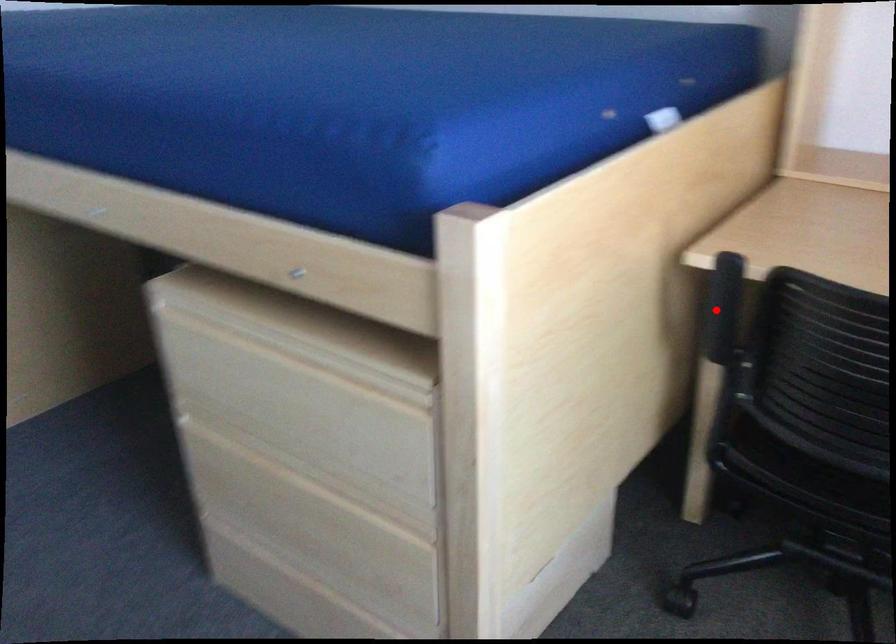
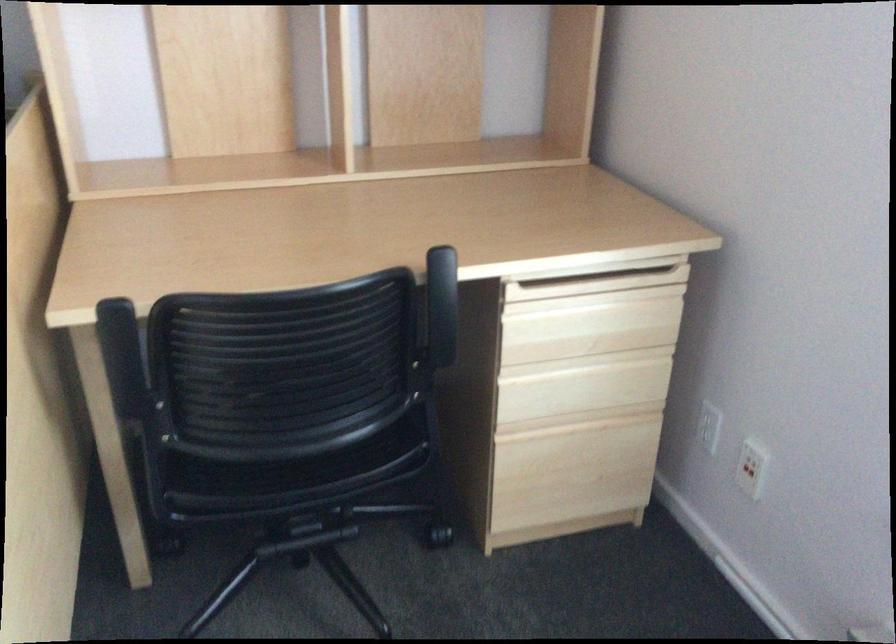
Question: I am providing you with two images of the same scene from different viewpoints. In image1, a red point is highlighted. Considering the same 3D point in image2, which of the following is correct?

Choices:
 (A) It is closer
 (B) It is farther

Answer: (A)